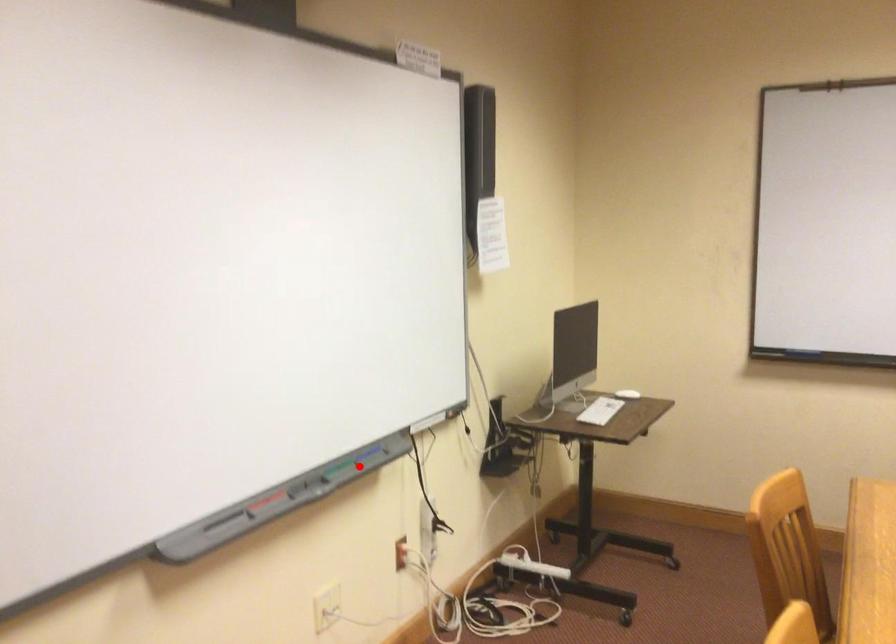
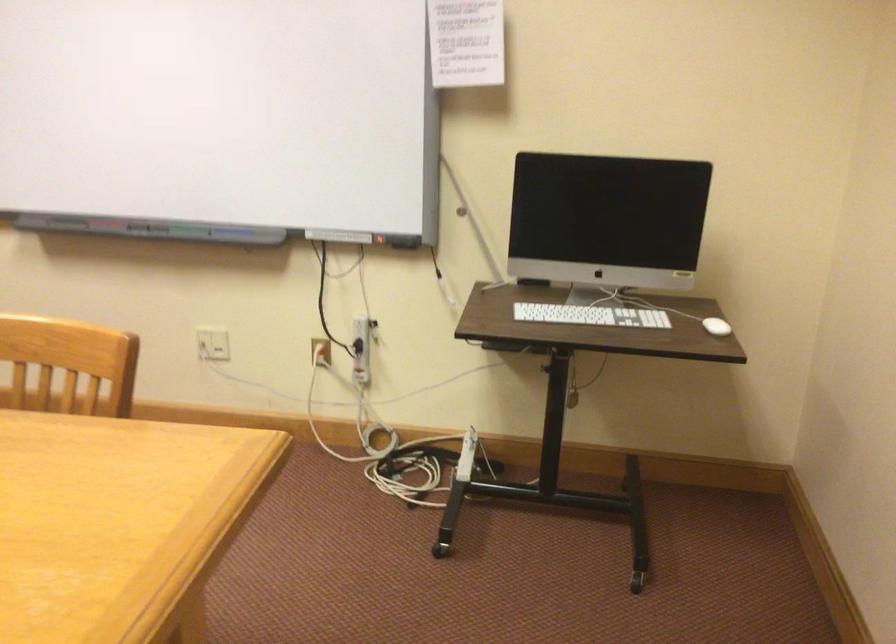
Question: A red point is marked in image1. In image2, is the corresponding 3D point closer to the camera or farther? Reply with the corresponding letter.

Choices:
 (A) The corresponding 3D point is closer.
 (B) The corresponding 3D point is farther.

Answer: (B)